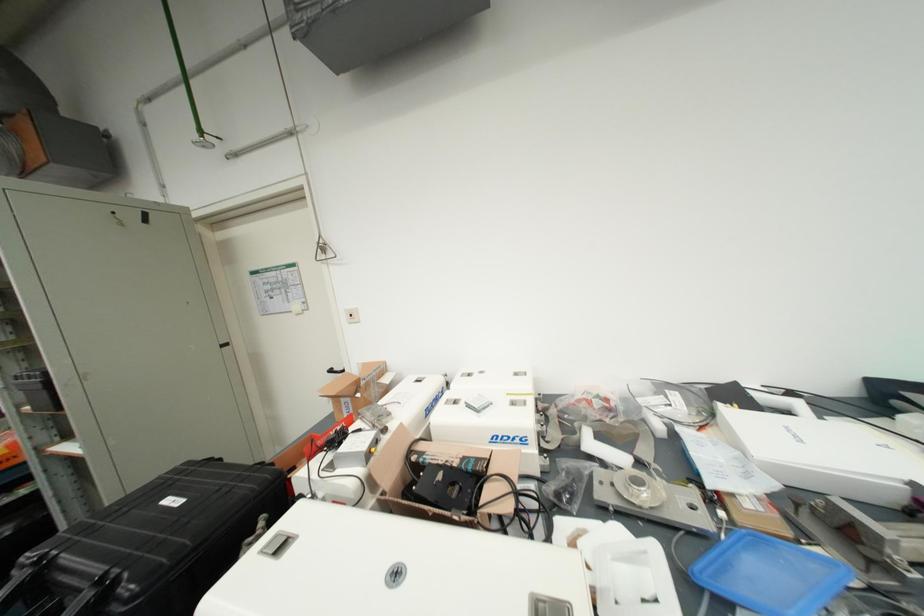
The width and height of the screenshot is (924, 616). In order to click on white light switch in this screenshot , I will do `click(351, 315)`.